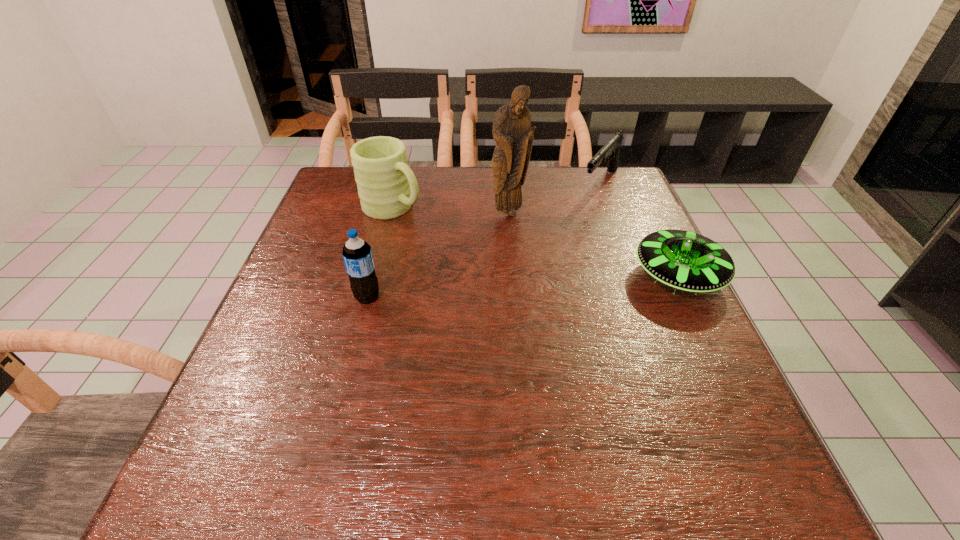
Locate an element on the screen. The width and height of the screenshot is (960, 540). free spot located 0.320m on the front-facing side of the figurine is located at coordinates (535, 306).

Locate an element on the screen. Image resolution: width=960 pixels, height=540 pixels. vacant space positioned at the aiming end of the gun is located at coordinates (568, 230).

Image resolution: width=960 pixels, height=540 pixels. Find the location of `vacant space positioned 0.250m at the aiming end of the gun`. vacant space positioned 0.250m at the aiming end of the gun is located at coordinates (554, 248).

This screenshot has width=960, height=540. Find the location of `vacant area situated 0.310m at the aiming end of the gun`. vacant area situated 0.310m at the aiming end of the gun is located at coordinates (542, 261).

Identify the location of free point located 0.250m on the side of the mug with the handle. (486, 259).

The height and width of the screenshot is (540, 960). What are the coordinates of `vacant space positioned 0.120m on the side of the mug with the handle` in the screenshot? It's located at (447, 237).

Identify the location of free space located 0.290m on the side of the mug with the handle. The width and height of the screenshot is (960, 540). (499, 266).

The height and width of the screenshot is (540, 960). I want to click on figurine that is at the far edge, so click(511, 130).

Where is `gun located in the far edge section of the desktop`? The width and height of the screenshot is (960, 540). gun located in the far edge section of the desktop is located at coordinates (610, 151).

The image size is (960, 540). I want to click on mug positioned at the far edge, so click(x=387, y=187).